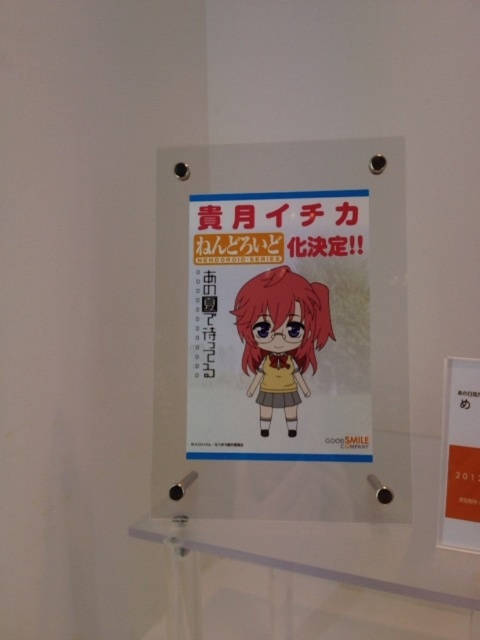
You are an art student who wants to frame the matte paper poster at center and the matte yellow uniform at center. The frame you have can only accommodate items up to the size of the poster. Which item will definitely fit in the frame?

The matte yellow uniform at center will definitely fit in the frame because it is smaller than the matte paper poster at center, which the frame can accommodate.

You are an interior designer who wants to hang a new picture frame that is 1.2 meters wide on the wall. You see the matte paper poster at center and the matte yellow uniform at center. Which object is taller, and will the new frame fit horizontally between them?

The matte paper poster at center is much taller than the matte yellow uniform at center. However, the question about fitting a 1.2 meter wide frame horizontally between them cannot be determined with the given information about their widths or spacing.

You are an interior designer who wants to hang a new picture frame exactly 10 cm to the right of the point marked at coordinates (x=278, y=326). Given that the display stand is 1 meter wide, can you determine if there is enough space to the right of the point to accommodate the frame without overlapping any existing objects?

→ The point at coordinates (x=278, y=326) corresponds to the matte paper poster at center. Since the display stand is 1 meter wide, moving 10 cm to the right from the center would still be within the stand, so there is enough space to hang the frame without overlapping existing objects.